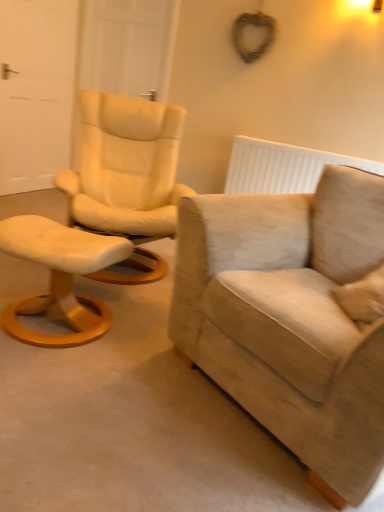
Question: Should I look upward or downward to see white textured radiator at upper right?

Choices:
 (A) up
 (B) down

Answer: (A)

Question: Is white textured radiator at upper right positioned far away from white matte door at left, marked as the 2th door in a right-to-left arrangement?

Choices:
 (A) no
 (B) yes

Answer: (B)

Question: Considering the relative positions of white textured radiator at upper right and white matte door at left, marked as the 2th door in a right-to-left arrangement, in the image provided, is white textured radiator at upper right to the left of white matte door at left, marked as the 2th door in a right-to-left arrangement, from the viewer's perspective?

Choices:
 (A) no
 (B) yes

Answer: (A)

Question: Is white textured radiator at upper right facing away from white matte door at left, marked as the 2th door in a right-to-left arrangement?

Choices:
 (A) yes
 (B) no

Answer: (B)

Question: Does white textured radiator at upper right have a lesser height compared to white matte door at left, marked as the 2th door in a right-to-left arrangement?

Choices:
 (A) yes
 (B) no

Answer: (A)

Question: Does white textured radiator at upper right have a smaller size compared to white matte door at left, marked as the 2th door in a right-to-left arrangement?

Choices:
 (A) yes
 (B) no

Answer: (A)

Question: Can you confirm if white textured radiator at upper right is positioned to the right of white matte door at left, marked as the 2th door in a right-to-left arrangement?

Choices:
 (A) no
 (B) yes

Answer: (B)

Question: Is the depth of white wood door at upper left, the 1th door positioned from the right, greater than that of white textured radiator at upper right?

Choices:
 (A) yes
 (B) no

Answer: (A)

Question: From a real-world perspective, is white wood door at upper left, the 1th door positioned from the right, on white textured radiator at upper right?

Choices:
 (A) yes
 (B) no

Answer: (A)

Question: Is white wood door at upper left, which appears as the 2th door when viewed from the left, turned away from white textured radiator at upper right?

Choices:
 (A) yes
 (B) no

Answer: (B)

Question: Is white wood door at upper left, the 1th door positioned from the right, placed right next to white textured radiator at upper right?

Choices:
 (A) no
 (B) yes

Answer: (A)

Question: Is white wood door at upper left, the 1th door positioned from the right, aimed at white textured radiator at upper right?

Choices:
 (A) yes
 (B) no

Answer: (B)

Question: Is white wood door at upper left, which appears as the 2th door when viewed from the left, not close to white textured radiator at upper right?

Choices:
 (A) yes
 (B) no

Answer: (A)

Question: Is beige fabric armchair at right not near white wood door at upper left, which appears as the 2th door when viewed from the left?

Choices:
 (A) yes
 (B) no

Answer: (A)